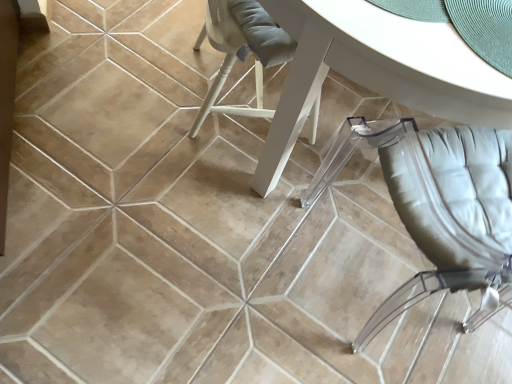
Identify the location of transparent leather chair at lower right. The width and height of the screenshot is (512, 384). (439, 208).

Image resolution: width=512 pixels, height=384 pixels. What do you see at coordinates (439, 208) in the screenshot?
I see `transparent leather chair at lower right` at bounding box center [439, 208].

This screenshot has width=512, height=384. What are the coordinates of `white glossy table at center` in the screenshot? It's located at (375, 71).

Describe the element at coordinates (375, 71) in the screenshot. I see `white glossy table at center` at that location.

Identify the location of transparent leather chair at lower right. (439, 208).

Which object is positioned more to the left, white glossy table at center or transparent leather chair at lower right?

white glossy table at center is more to the left.

Which is in front, white glossy table at center or transparent leather chair at lower right?

transparent leather chair at lower right is in front.

In the scene shown: Which is nearer, (318, 66) or (497, 246)?

Positioned in front is point (318, 66).

From the image's perspective, who appears lower, white glossy table at center or transparent leather chair at lower right?

transparent leather chair at lower right appears lower in the image.

From a real-world perspective, is white glossy table at center below transparent leather chair at lower right?

Yes, from a real-world perspective, white glossy table at center is below transparent leather chair at lower right.

From the picture: Considering the relative sizes of white glossy table at center and transparent leather chair at lower right in the image provided, is white glossy table at center thinner than transparent leather chair at lower right?

In fact, white glossy table at center might be wider than transparent leather chair at lower right.

Who is shorter, white glossy table at center or transparent leather chair at lower right?

white glossy table at center.

Can you confirm if white glossy table at center is bigger than transparent leather chair at lower right?

Correct, white glossy table at center is larger in size than transparent leather chair at lower right.

Would you say white glossy table at center contains transparent leather chair at lower right?

No, transparent leather chair at lower right is not surrounded by white glossy table at center.

Is white glossy table at center next to transparent leather chair at lower right and touching it?

No, white glossy table at center is not touching transparent leather chair at lower right.

Is white glossy table at center turned away from transparent leather chair at lower right?

Yes, white glossy table at center's orientation is away from transparent leather chair at lower right.

How many degrees apart are the facing directions of white glossy table at center and transparent leather chair at lower right?

4.35e-06 degrees.

How far apart are white glossy table at center and transparent leather chair at lower right?

They are 9.46 inches apart.

Locate an element on the screen. This screenshot has width=512, height=384. chair on the right of white glossy table at center is located at coordinates (439, 208).

Can you confirm if transparent leather chair at lower right is positioned to the left of white glossy table at center?

No.

Which is in front, transparent leather chair at lower right or white glossy table at center?

Positioned in front is transparent leather chair at lower right.

Considering the positions of points (421, 202) and (342, 58), is point (421, 202) farther from camera compared to point (342, 58)?

Yes, it is.

From the image's perspective, is transparent leather chair at lower right positioned above or below white glossy table at center?

Based on their image positions, transparent leather chair at lower right is located beneath white glossy table at center.

From a real-world perspective, which is physically below, transparent leather chair at lower right or white glossy table at center?

In real-world perspective, white glossy table at center is lower.

Considering the relative sizes of transparent leather chair at lower right and white glossy table at center in the image provided, is transparent leather chair at lower right thinner than white glossy table at center?

Yes, transparent leather chair at lower right is thinner than white glossy table at center.

Can you confirm if transparent leather chair at lower right is taller than white glossy table at center?

Correct, transparent leather chair at lower right is much taller as white glossy table at center.

Can you confirm if transparent leather chair at lower right is bigger than white glossy table at center?

Incorrect, transparent leather chair at lower right is not larger than white glossy table at center.

Is transparent leather chair at lower right not within white glossy table at center?

That's correct, transparent leather chair at lower right is outside of white glossy table at center.

Are transparent leather chair at lower right and white glossy table at center beside each other?

They are not placed beside each other.

Does transparent leather chair at lower right turn towards white glossy table at center?

Yes, transparent leather chair at lower right is facing white glossy table at center.

The height and width of the screenshot is (384, 512). I want to click on table on the left side of transparent leather chair at lower right, so click(x=375, y=71).

The image size is (512, 384). I want to click on table that is under the transparent leather chair at lower right (from a real-world perspective), so click(375, 71).

Locate an element on the screen. The height and width of the screenshot is (384, 512). chair on the right side of white glossy table at center is located at coordinates (439, 208).